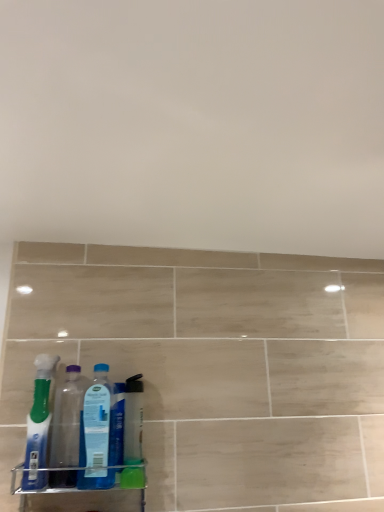
What do you see at coordinates (67, 419) in the screenshot?
I see `transparent plastic bottle at left, the 2th bottle positioned from the left` at bounding box center [67, 419].

Identify the location of blue translucent bottle at center, the first bottle when ordered from right to left. The height and width of the screenshot is (512, 384). (97, 433).

The width and height of the screenshot is (384, 512). I want to click on translucent blue toothbrush at left, marked as the 1th bottle in a left-to-right arrangement, so click(39, 425).

Who is shorter, blue translucent bottle at center, the 3th bottle in the left-to-right sequence, or translucent blue toothbrush at left, marked as the 1th bottle in a left-to-right arrangement?

Standing shorter between the two is blue translucent bottle at center, the 3th bottle in the left-to-right sequence.

This screenshot has height=512, width=384. Find the location of `bottle that is the 2nd object above the blue translucent bottle at center, the first bottle when ordered from right to left (from a real-world perspective)`. bottle that is the 2nd object above the blue translucent bottle at center, the first bottle when ordered from right to left (from a real-world perspective) is located at coordinates (39, 425).

Considering their positions, is blue translucent bottle at center, the first bottle when ordered from right to left, located in front of or behind translucent blue toothbrush at left, marked as the 1th bottle in a left-to-right arrangement?

Clearly, blue translucent bottle at center, the first bottle when ordered from right to left, is behind translucent blue toothbrush at left, marked as the 1th bottle in a left-to-right arrangement.

From the image's perspective, is blue translucent bottle at center, the first bottle when ordered from right to left, on top of translucent blue toothbrush at left, the 3th bottle from the right?

Incorrect, from the image's perspective, blue translucent bottle at center, the first bottle when ordered from right to left, is lower than translucent blue toothbrush at left, the 3th bottle from the right.

From the image's perspective, is transparent plastic bottle at left, the 2th bottle when ordered from right to left, on blue translucent bottle at center, the 3th bottle in the left-to-right sequence?

Incorrect, from the image's perspective, transparent plastic bottle at left, the 2th bottle when ordered from right to left, is lower than blue translucent bottle at center, the 3th bottle in the left-to-right sequence.

From their relative heights in the image, would you say transparent plastic bottle at left, the 2th bottle when ordered from right to left, is taller or shorter than blue translucent bottle at center, the 3th bottle in the left-to-right sequence?

Considering their sizes, transparent plastic bottle at left, the 2th bottle when ordered from right to left, has more height than blue translucent bottle at center, the 3th bottle in the left-to-right sequence.

Considering the points (60, 485) and (105, 486), which point is behind, point (60, 485) or point (105, 486)?

The point (60, 485) is farther.

Is transparent plastic bottle at left, the 2th bottle when ordered from right to left, looking in the opposite direction of clear plastic spray bottle at center?

No.

From the image's perspective, is transparent plastic bottle at left, the 2th bottle positioned from the left, beneath clear plastic spray bottle at center?

Incorrect, from the image's perspective, transparent plastic bottle at left, the 2th bottle positioned from the left, is higher than clear plastic spray bottle at center.

From a real-world perspective, is transparent plastic bottle at left, the 2th bottle positioned from the left, over clear plastic spray bottle at center?

Indeed, from a real-world perspective, transparent plastic bottle at left, the 2th bottle positioned from the left, stands above clear plastic spray bottle at center.

Locate an element on the screen. The height and width of the screenshot is (512, 384). cleaning product behind the translucent blue toothbrush at left, marked as the 1th bottle in a left-to-right arrangement is located at coordinates pyautogui.click(x=133, y=421).

Between clear plastic spray bottle at center and translucent blue toothbrush at left, marked as the 1th bottle in a left-to-right arrangement, which one appears on the right side from the viewer's perspective?

From the viewer's perspective, clear plastic spray bottle at center appears more on the right side.

Is clear plastic spray bottle at center wider than translucent blue toothbrush at left, the 3th bottle from the right?

No.

Would you say clear plastic spray bottle at center contains translucent blue toothbrush at left, the 3th bottle from the right?

Definitely not — translucent blue toothbrush at left, the 3th bottle from the right, is not inside clear plastic spray bottle at center.

Considering their positions, is transparent plastic bottle at left, the 2th bottle positioned from the left, located in front of or behind translucent blue toothbrush at left, the 3th bottle from the right?

transparent plastic bottle at left, the 2th bottle positioned from the left, is positioned farther from the viewer than translucent blue toothbrush at left, the 3th bottle from the right.

Can we say transparent plastic bottle at left, the 2th bottle positioned from the left, lies outside translucent blue toothbrush at left, the 3th bottle from the right?

That's correct, transparent plastic bottle at left, the 2th bottle positioned from the left, is outside of translucent blue toothbrush at left, the 3th bottle from the right.

Are transparent plastic bottle at left, the 2th bottle when ordered from right to left, and translucent blue toothbrush at left, the 3th bottle from the right, located far from each other?

No, there isn't a large distance between transparent plastic bottle at left, the 2th bottle when ordered from right to left, and translucent blue toothbrush at left, the 3th bottle from the right.

From the image's perspective, is transparent plastic bottle at left, the 2th bottle positioned from the left, located beneath translucent blue toothbrush at left, marked as the 1th bottle in a left-to-right arrangement?

Indeed, from the image's perspective, transparent plastic bottle at left, the 2th bottle positioned from the left, is shown beneath translucent blue toothbrush at left, marked as the 1th bottle in a left-to-right arrangement.

Which is in front, point (44, 413) or point (81, 428)?

The point (44, 413) is in front.

Which of these two, translucent blue toothbrush at left, the 3th bottle from the right, or blue translucent bottle at center, the 3th bottle in the left-to-right sequence, is smaller?

With smaller size is blue translucent bottle at center, the 3th bottle in the left-to-right sequence.

Is translucent blue toothbrush at left, the 3th bottle from the right, beside blue translucent bottle at center, the first bottle when ordered from right to left?

translucent blue toothbrush at left, the 3th bottle from the right, and blue translucent bottle at center, the first bottle when ordered from right to left, are clearly separated.

Which object is further away from the camera, translucent blue toothbrush at left, the 3th bottle from the right, or blue translucent bottle at center, the 3th bottle in the left-to-right sequence?

blue translucent bottle at center, the 3th bottle in the left-to-right sequence, is behind.

Is clear plastic spray bottle at center oriented towards transparent plastic bottle at left, the 2th bottle positioned from the left?

No, clear plastic spray bottle at center is not turned towards transparent plastic bottle at left, the 2th bottle positioned from the left.

What's the angular difference between clear plastic spray bottle at center and transparent plastic bottle at left, the 2th bottle positioned from the left,'s facing directions?

0.00076 degrees.

Who is taller, clear plastic spray bottle at center or transparent plastic bottle at left, the 2th bottle positioned from the left?

With more height is transparent plastic bottle at left, the 2th bottle positioned from the left.

Locate an element on the screen. The height and width of the screenshot is (512, 384). bottle lying above the blue translucent bottle at center, the 3th bottle in the left-to-right sequence (from the image's perspective) is located at coordinates (39, 425).

Image resolution: width=384 pixels, height=512 pixels. Identify the location of the 1st bottle above the blue translucent bottle at center, the first bottle when ordered from right to left (from a real-world perspective). (67, 419).

Which object lies nearer to the anchor point blue translucent bottle at center, the first bottle when ordered from right to left, clear plastic spray bottle at center or transparent plastic bottle at left, the 2th bottle when ordered from right to left?

The object closer to blue translucent bottle at center, the first bottle when ordered from right to left, is clear plastic spray bottle at center.

Looking at the image, which one is located further to translucent blue toothbrush at left, marked as the 1th bottle in a left-to-right arrangement, transparent plastic bottle at left, the 2th bottle when ordered from right to left, or blue translucent bottle at center, the first bottle when ordered from right to left?

Based on the image, blue translucent bottle at center, the first bottle when ordered from right to left, appears to be further to translucent blue toothbrush at left, marked as the 1th bottle in a left-to-right arrangement.

Based on their spatial positions, is clear plastic spray bottle at center or blue translucent bottle at center, the first bottle when ordered from right to left, further from translucent blue toothbrush at left, the 3th bottle from the right?

clear plastic spray bottle at center.

Estimate the real-world distances between objects in this image. Which object is closer to translucent blue toothbrush at left, marked as the 1th bottle in a left-to-right arrangement, transparent plastic bottle at left, the 2th bottle when ordered from right to left, or clear plastic spray bottle at center?

transparent plastic bottle at left, the 2th bottle when ordered from right to left, is closer to translucent blue toothbrush at left, marked as the 1th bottle in a left-to-right arrangement.

Considering their positions, is blue translucent bottle at center, the 3th bottle in the left-to-right sequence, positioned closer to translucent blue toothbrush at left, marked as the 1th bottle in a left-to-right arrangement, than clear plastic spray bottle at center?

Among the two, blue translucent bottle at center, the 3th bottle in the left-to-right sequence, is located nearer to translucent blue toothbrush at left, marked as the 1th bottle in a left-to-right arrangement.

Considering their positions, is clear plastic spray bottle at center positioned closer to transparent plastic bottle at left, the 2th bottle positioned from the left, than translucent blue toothbrush at left, the 3th bottle from the right?

The object closer to transparent plastic bottle at left, the 2th bottle positioned from the left, is translucent blue toothbrush at left, the 3th bottle from the right.

Considering their positions, is transparent plastic bottle at left, the 2th bottle when ordered from right to left, positioned further to clear plastic spray bottle at center than blue translucent bottle at center, the 3th bottle in the left-to-right sequence?

The object further to clear plastic spray bottle at center is transparent plastic bottle at left, the 2th bottle when ordered from right to left.

Estimate the real-world distances between objects in this image. Which object is closer to transparent plastic bottle at left, the 2th bottle positioned from the left, clear plastic spray bottle at center or blue translucent bottle at center, the 3th bottle in the left-to-right sequence?

blue translucent bottle at center, the 3th bottle in the left-to-right sequence, is positioned closer to the anchor transparent plastic bottle at left, the 2th bottle positioned from the left.

Find the location of a particular element. Image resolution: width=384 pixels, height=512 pixels. bottle located between transparent plastic bottle at left, the 2th bottle when ordered from right to left, and clear plastic spray bottle at center in the left-right direction is located at coordinates (97, 433).

The width and height of the screenshot is (384, 512). I want to click on bottle between translucent blue toothbrush at left, marked as the 1th bottle in a left-to-right arrangement, and blue translucent bottle at center, the 3th bottle in the left-to-right sequence, so click(67, 419).